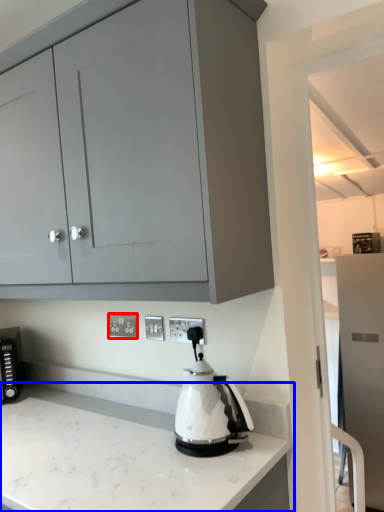
Question: Among these objects, which one is nearest to the camera, electric outlet (highlighted by a red box) or countertop (highlighted by a blue box)?

Choices:
 (A) electric outlet
 (B) countertop

Answer: (B)